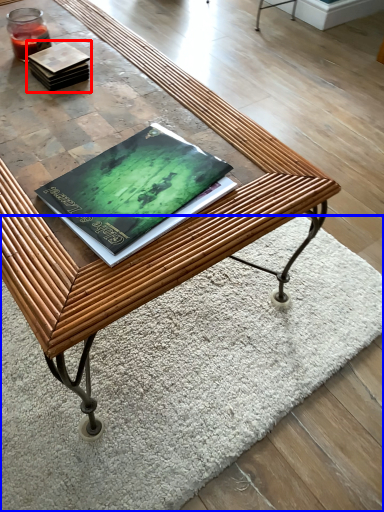
Question: Which object is closer to the camera taking this photo, book (highlighted by a red box) or mat (highlighted by a blue box)?

Choices:
 (A) book
 (B) mat

Answer: (B)